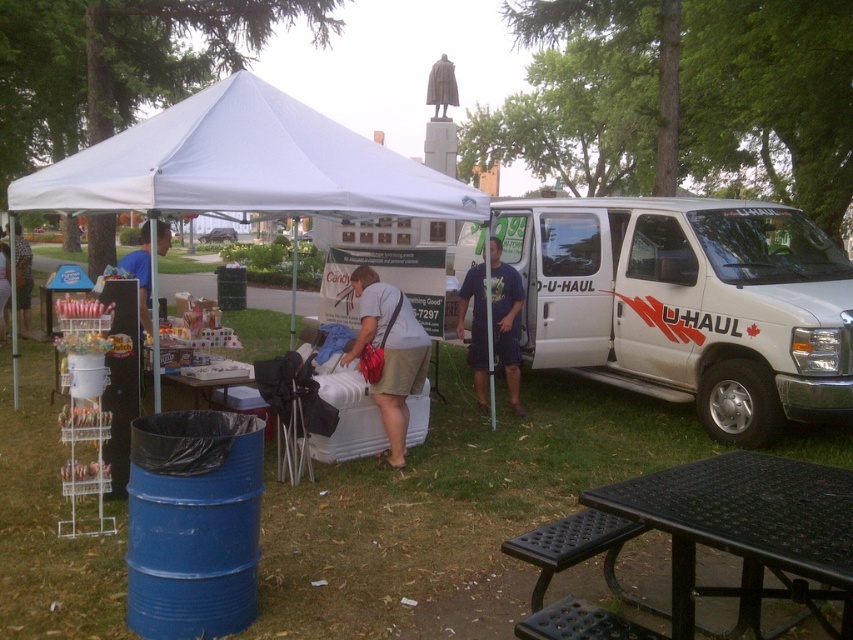
Question: Is white fabric tent at center thinner than matte black shirt at center?

Choices:
 (A) no
 (B) yes

Answer: (B)

Question: Is white fabric tent at center thinner than black metal picnic table at lower right?

Choices:
 (A) yes
 (B) no

Answer: (A)

Question: Which point is closer to the camera?

Choices:
 (A) matte black shirt at center
 (B) matte white cooler at center
 (C) black metal picnic table at lower right
 (D) white matte van at right

Answer: (C)

Question: Can you confirm if white matte van at right is wider than matte white cooler at center?

Choices:
 (A) no
 (B) yes

Answer: (B)

Question: Which point is closer to the camera?

Choices:
 (A) white matte van at right
 (B) matte white cooler at center
 (C) white fabric canopy at center
 (D) white fabric tent at center

Answer: (D)

Question: Which object is the farthest from the white fabric canopy at center?

Choices:
 (A) white fabric tent at center
 (B) matte white cooler at center
 (C) white matte van at right

Answer: (C)